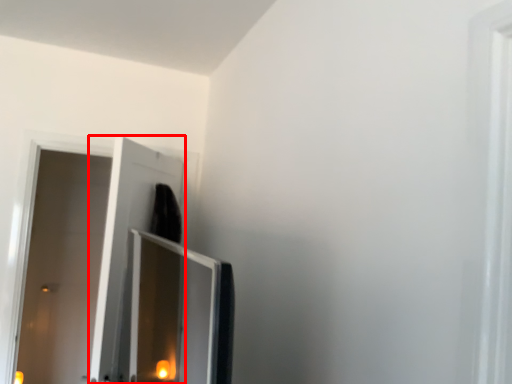
Question: Considering the relative positions of screen door (annotated by the red box) and door in the image provided, where is screen door (annotated by the red box) located with respect to the staircase?

Choices:
 (A) right
 (B) left

Answer: (A)